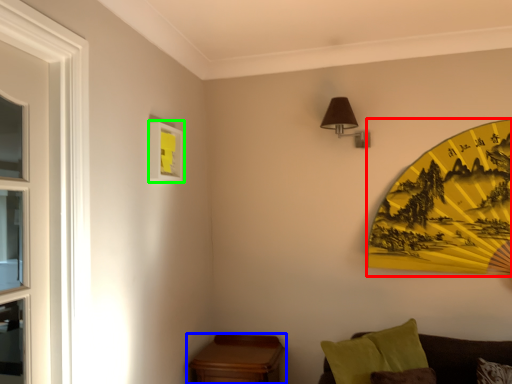
Question: Based on their relative distances, which object is nearer to design (highlighted by a red box)? Choose from table (highlighted by a blue box) and picture frame (highlighted by a green box).

Choices:
 (A) table
 (B) picture frame

Answer: (A)